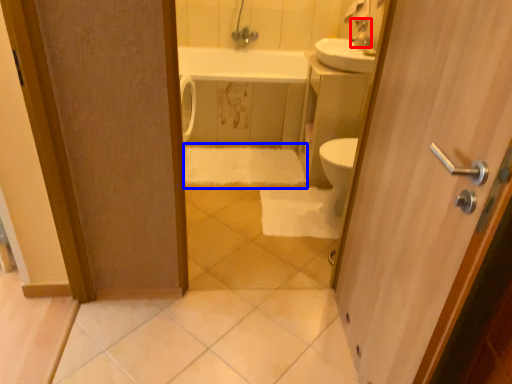
Question: Which point is closer to the camera, faucet (highlighted by a red box) or bath towel (highlighted by a blue box)?

Choices:
 (A) faucet
 (B) bath towel

Answer: (A)